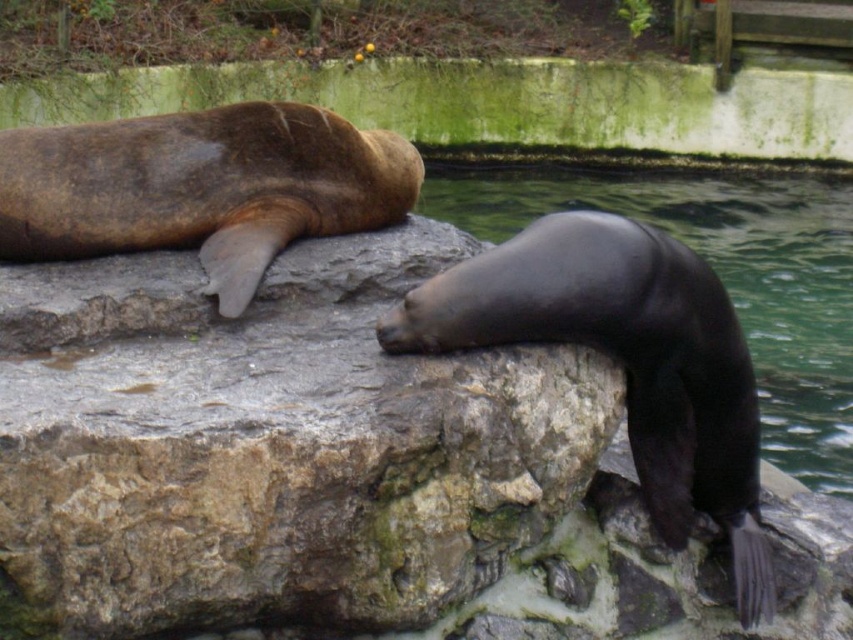
Who is lower down, brown rough rock at center or glossy black seal at right?

brown rough rock at center is lower down.

Is brown rough rock at center shorter than glossy black seal at right?

No.

What do you see at coordinates (270, 445) in the screenshot?
I see `brown rough rock at center` at bounding box center [270, 445].

You are a GUI agent. You are given a task and a screenshot of the screen. Output one action in this format:
    pyautogui.click(x=<x>, y=<y>)
    Task: Click on the brown rough rock at center
    The image size is (853, 640).
    Given the screenshot: What is the action you would take?
    pyautogui.click(x=270, y=445)